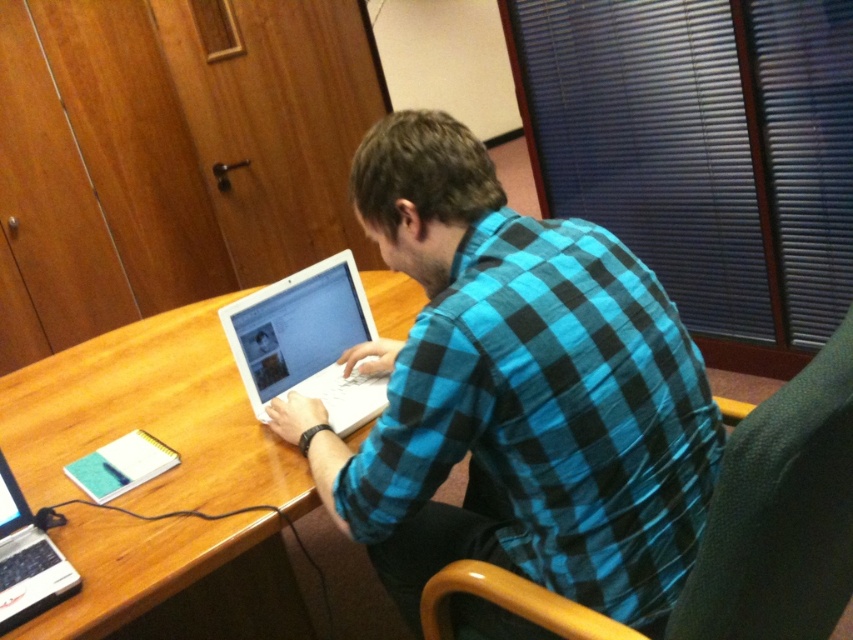
You are standing in the room and want to place a new object on the wooden table at center. What are the coordinates where you should place it?

The coordinates for placing the new object on the wooden table at center are at point [149,417].

You are organizing a desk and need to place the white glossy laptop at center and the silver metallic laptop at lower left. According to the scene, which laptop is placed on top of the other?

The white glossy laptop at center is positioned over the silver metallic laptop at lower left, meaning it is placed on top of the silver metallic laptop at lower left.